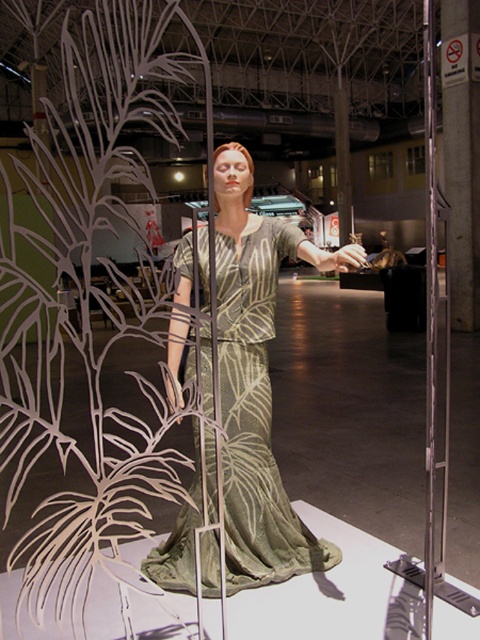
Does green leafy plant at center appear on the left side of silvery metallic dress at center?

Indeed, green leafy plant at center is positioned on the left side of silvery metallic dress at center.

Who is more distant from viewer, [156,120] or [278,532]?

Point [156,120]

Identify the location of green leafy plant at center. (91, 314).